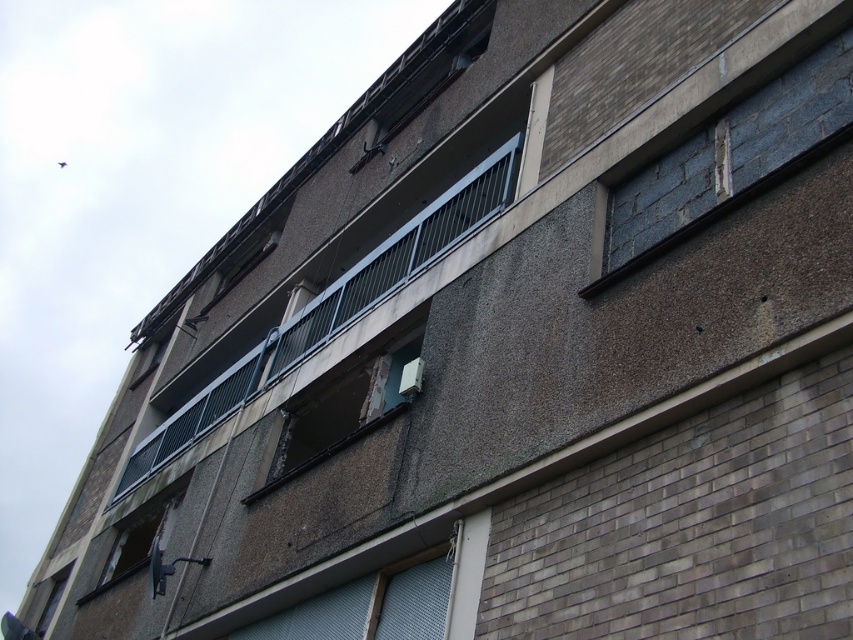
Question: Can you confirm if blue concrete window at upper right is smaller than rusty metal window at lower left?

Choices:
 (A) yes
 (B) no

Answer: (A)

Question: Which point is closer to the camera taking this photo?

Choices:
 (A) (711, 161)
 (B) (152, 538)

Answer: (A)

Question: Which object is closer to the camera taking this photo?

Choices:
 (A) blue concrete window at upper right
 (B) rusty metal window at center

Answer: (A)

Question: Is blue concrete window at upper right positioned in front of rusty metal window at center?

Choices:
 (A) no
 (B) yes

Answer: (B)

Question: Does rusty metal window at center appear over rusty metal window at lower left?

Choices:
 (A) no
 (B) yes

Answer: (B)

Question: Among these objects, which one is farthest from the camera?

Choices:
 (A) blue concrete window at upper right
 (B) rusty metal window at lower left

Answer: (B)